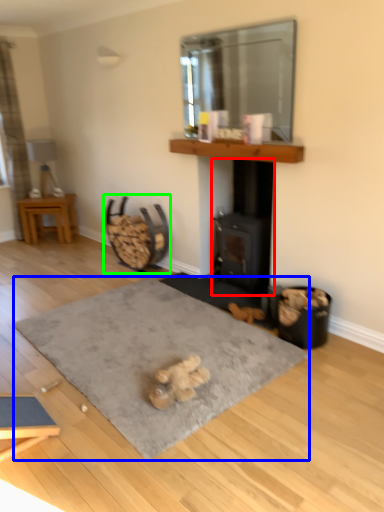
Question: Considering the real-world distances, which object is closest to wood burning stove (highlighted by a red box)? yoga mat (highlighted by a blue box) or rocking chair (highlighted by a green box).

Choices:
 (A) yoga mat
 (B) rocking chair

Answer: (B)